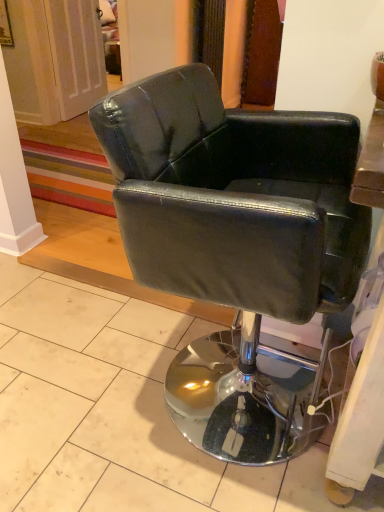
This screenshot has width=384, height=512. I want to click on vacant location below black leather chair at center (from a real-world perspective), so click(x=214, y=391).